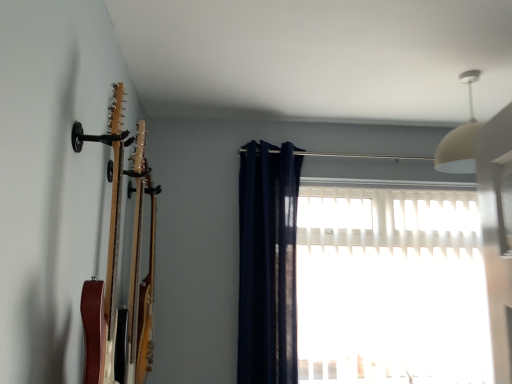
Find the location of a particular element. navy blue fabric curtain at center is located at coordinates (268, 263).

You are a GUI agent. You are given a task and a screenshot of the screen. Output one action in this format:
    pyautogui.click(x=<x>, y=<y>)
    Task: Click on the wooden acoustic guitar at left
    The image size is (512, 384).
    Given the screenshot: What is the action you would take?
    pyautogui.click(x=138, y=267)

Does navy blue fabric curtain at center have a larger size compared to wooden acoustic guitar at left?

Yes, navy blue fabric curtain at center is bigger than wooden acoustic guitar at left.

From the image's perspective, is navy blue fabric curtain at center positioned above or below wooden acoustic guitar at left?

navy blue fabric curtain at center is below wooden acoustic guitar at left.

Is navy blue fabric curtain at center oriented towards wooden acoustic guitar at left?

No.

From a real-world perspective, is navy blue fabric curtain at center positioned under white translucent blinds at center based on gravity?

Incorrect, from a real-world perspective, navy blue fabric curtain at center is higher than white translucent blinds at center.

Does point (268, 275) come in front of point (359, 339)?

That is True.

Is navy blue fabric curtain at center oriented towards white translucent blinds at center?

No, navy blue fabric curtain at center does not turn towards white translucent blinds at center.

Can you confirm if navy blue fabric curtain at center is wider than white translucent blinds at center?

Indeed, navy blue fabric curtain at center has a greater width compared to white translucent blinds at center.

You are a GUI agent. You are given a task and a screenshot of the screen. Output one action in this format:
    pyautogui.click(x=<x>, y=<y>)
    Task: Click on the guitar located on the left of white translucent blinds at center
    This screenshot has height=384, width=512.
    Given the screenshot: What is the action you would take?
    pyautogui.click(x=138, y=267)

Is white translucent blinds at center oriented towards wooden acoustic guitar at left?

No, white translucent blinds at center is not aimed at wooden acoustic guitar at left.

Is white translucent blinds at center in front of or behind wooden acoustic guitar at left in the image?

white translucent blinds at center is behind wooden acoustic guitar at left.

Looking at this image, considering the relative sizes of white translucent blinds at center and wooden acoustic guitar at left in the image provided, is white translucent blinds at center smaller than wooden acoustic guitar at left?

Actually, white translucent blinds at center might be larger than wooden acoustic guitar at left.

Does wooden acoustic guitar at left touch white translucent blinds at center?

wooden acoustic guitar at left is not next to white translucent blinds at center, and they're not touching.

From the image's perspective, would you say wooden acoustic guitar at left is shown under white translucent blinds at center?

No, from the image's perspective, wooden acoustic guitar at left is not beneath white translucent blinds at center.

Who is shorter, wooden acoustic guitar at left or white translucent blinds at center?

Standing shorter between the two is wooden acoustic guitar at left.

Based on the photo, is wooden acoustic guitar at left facing towards white translucent blinds at center?

No, wooden acoustic guitar at left is not aimed at white translucent blinds at center.

In the scene shown: Would you consider wooden acoustic guitar at left to be distant from navy blue fabric curtain at center?

No.

From a real-world perspective, does wooden acoustic guitar at left sit lower than navy blue fabric curtain at center?

Yes.

Can we say wooden acoustic guitar at left lies outside navy blue fabric curtain at center?

Yes.

Considering the positions of objects wooden acoustic guitar at left and navy blue fabric curtain at center in the image provided, who is more to the right, wooden acoustic guitar at left or navy blue fabric curtain at center?

navy blue fabric curtain at center.

Based on their positions, is white translucent blinds at center located to the left or right of navy blue fabric curtain at center?

white translucent blinds at center is positioned on navy blue fabric curtain at center's right side.

From their relative heights in the image, would you say white translucent blinds at center is taller or shorter than navy blue fabric curtain at center?

Considering their sizes, white translucent blinds at center has less height than navy blue fabric curtain at center.

Would you say white translucent blinds at center is a long distance from navy blue fabric curtain at center?

white translucent blinds at center is actually quite close to navy blue fabric curtain at center.

Is white translucent blinds at center positioned before navy blue fabric curtain at center?

No.

Locate an element on the screen. The image size is (512, 384). guitar located on the left of navy blue fabric curtain at center is located at coordinates (138, 267).

At what (x,y) coordinates should I click in order to perform the action: click on curtain in front of the white translucent blinds at center. Please return your answer as a coordinate pair (x, y). Looking at the image, I should click on (268, 263).

Considering their positions, is navy blue fabric curtain at center positioned closer to white translucent blinds at center than wooden acoustic guitar at left?

navy blue fabric curtain at center is closer to white translucent blinds at center.

Considering their positions, is navy blue fabric curtain at center positioned further to wooden acoustic guitar at left than white translucent blinds at center?

white translucent blinds at center is further to wooden acoustic guitar at left.

Consider the image. When comparing their distances from wooden acoustic guitar at left, does white translucent blinds at center or navy blue fabric curtain at center seem closer?

Among the two, navy blue fabric curtain at center is located nearer to wooden acoustic guitar at left.

From the image, which object appears to be farther from navy blue fabric curtain at center, wooden acoustic guitar at left or white translucent blinds at center?

wooden acoustic guitar at left.

When comparing their distances from navy blue fabric curtain at center, does white translucent blinds at center or wooden acoustic guitar at left seem further?

The object further to navy blue fabric curtain at center is wooden acoustic guitar at left.

Estimate the real-world distances between objects in this image. Which object is closer to white translucent blinds at center, wooden acoustic guitar at left or navy blue fabric curtain at center?

Among the two, navy blue fabric curtain at center is located nearer to white translucent blinds at center.

Where is `curtain located between wooden acoustic guitar at left and white translucent blinds at center in the left-right direction`? This screenshot has height=384, width=512. curtain located between wooden acoustic guitar at left and white translucent blinds at center in the left-right direction is located at coordinates (268, 263).